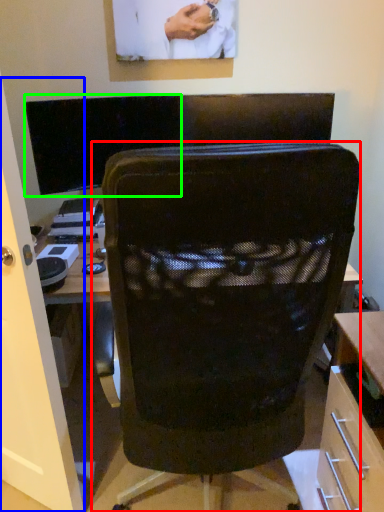
Question: Which is nearer to the chair (highlighted by a red box)? glass door (highlighted by a blue box) or computer monitor (highlighted by a green box).

Choices:
 (A) glass door
 (B) computer monitor

Answer: (A)